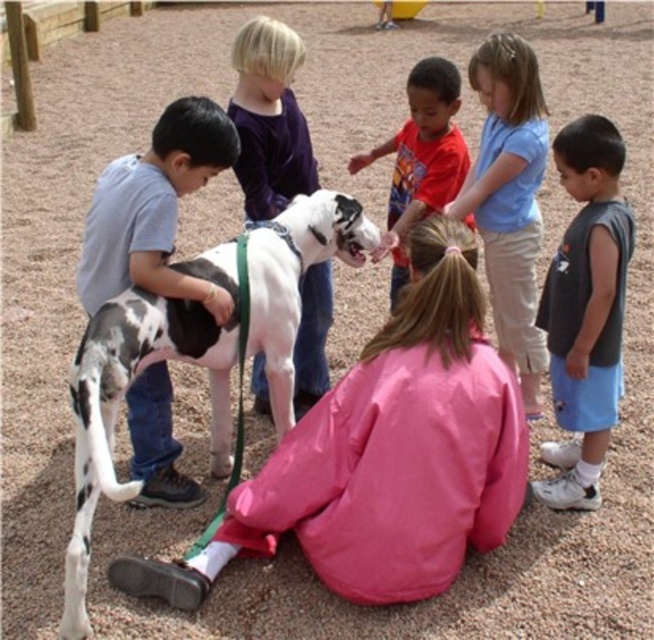
You are a photographer trying to capture a photo of the spotted fur dog at center and the gray sleeveless shirt at right. Based on their positions, which one would appear larger in the photo?

The spotted fur dog at center would appear larger in the photo because it is closer to the viewer than the gray sleeveless shirt at right.

From the picture: You are a photographer trying to capture a group photo of the gray sleeveless shirt at right and the light blue cotton shirt at upper center. Which of the two should you position closer to the camera to ensure both appear the same height in the photo?

Since the gray sleeveless shirt at right is shorter than the light blue cotton shirt at upper center, you should position the gray sleeveless shirt at right closer to the camera to make them appear the same height in the photo.

Consider the image. You are a photographer trying to capture a group photo of the gray sleeveless shirt at right and the red cotton shirt at center. Based on their heights, which child should you place closer to the camera to ensure both are visible in the photo?

The gray sleeveless shirt at right is much taller than the red cotton shirt at center. To ensure both are visible in the photo, place the red cotton shirt at center closer to the camera so their face is not hidden behind the taller child.